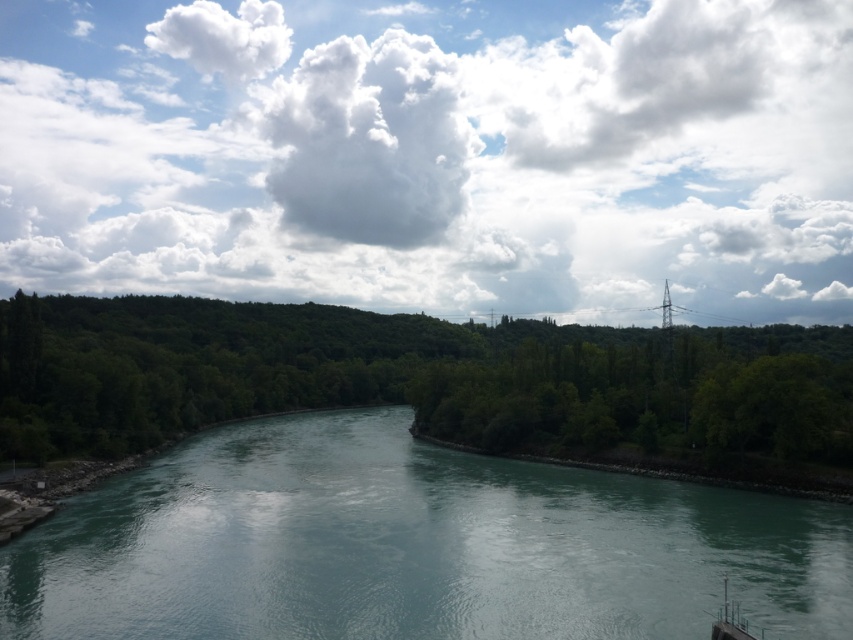
Question: Among these objects, which one is nearest to the camera?

Choices:
 (A) green leafy trees at left
 (B) white fluffy cloud at upper center
 (C) teal smooth water at center

Answer: (C)

Question: Does teal smooth water at center appear on the right side of green leafy trees at left?

Choices:
 (A) yes
 (B) no

Answer: (B)

Question: Does teal smooth water at center have a larger size compared to green leafy trees at left?

Choices:
 (A) no
 (B) yes

Answer: (A)

Question: Which is nearer to the teal smooth water at center?

Choices:
 (A) white fluffy cloud at upper center
 (B) green leafy trees at left

Answer: (B)

Question: Is white fluffy cloud at upper center bigger than green leafy trees at left?

Choices:
 (A) no
 (B) yes

Answer: (B)

Question: Which point is closer to the camera?

Choices:
 (A) (277, 593)
 (B) (646, 340)
 (C) (256, 24)

Answer: (A)